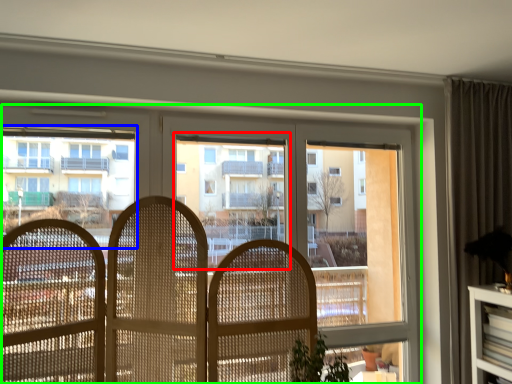
Question: Which object is the farthest from bay window (highlighted by a red box)? Choose among these: condominium (highlighted by a blue box) or window (highlighted by a green box).

Choices:
 (A) condominium
 (B) window

Answer: (A)